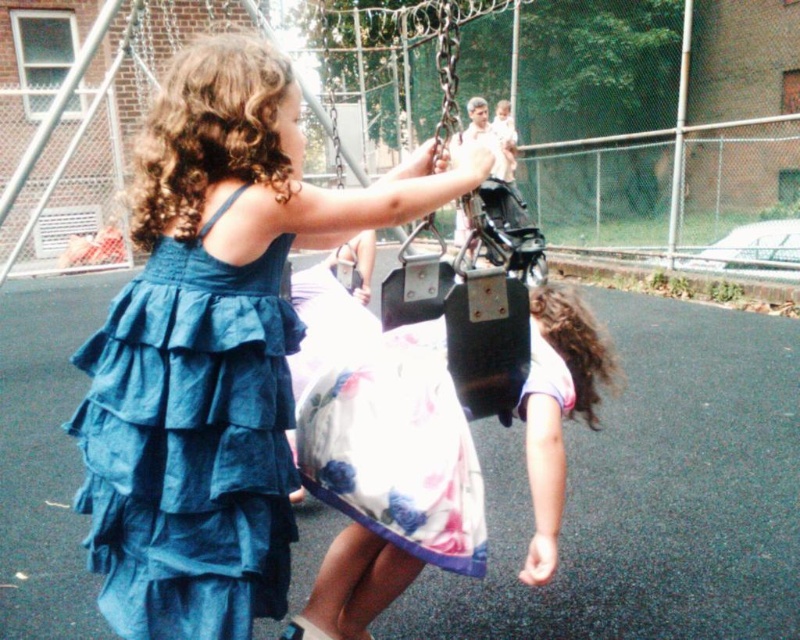
Who is more distant from viewer, (338, 349) or (566, 310)?

The point (338, 349) is more distant.

Locate an element on the screen. floral satin dress at center is located at coordinates (384, 428).

Measure the distance between blue cotton dress at center and white floral dress at center.

18.08 inches

Between blue cotton dress at center and white floral dress at center, which one has less height?

white floral dress at center

This screenshot has height=640, width=800. I want to click on blue cotton dress at center, so pos(214,346).

Describe the element at coordinates (214, 346) in the screenshot. This screenshot has width=800, height=640. I see `blue cotton dress at center` at that location.

Between blue cotton dress at center and blue ruffled fabric dress at upper left, which one is positioned lower?

Positioned lower is blue ruffled fabric dress at upper left.

Is point (268, 60) in front of point (176, 392)?

No, (268, 60) is behind (176, 392).

In order to click on blue cotton dress at center in this screenshot , I will do `click(214, 346)`.